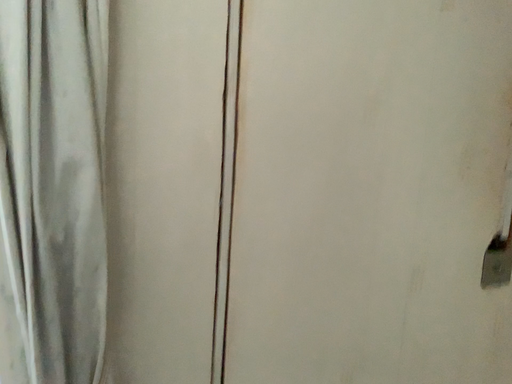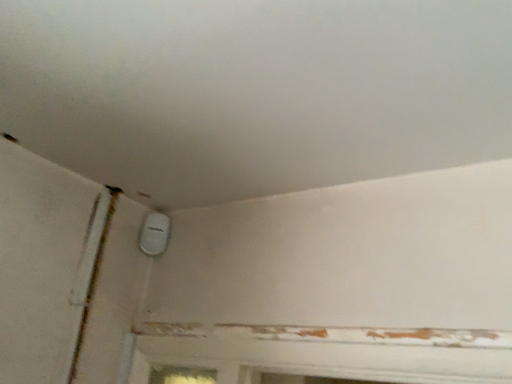
Question: How did the camera likely rotate when shooting the video?

Choices:
 (A) rotated downward
 (B) rotated upward

Answer: (B)